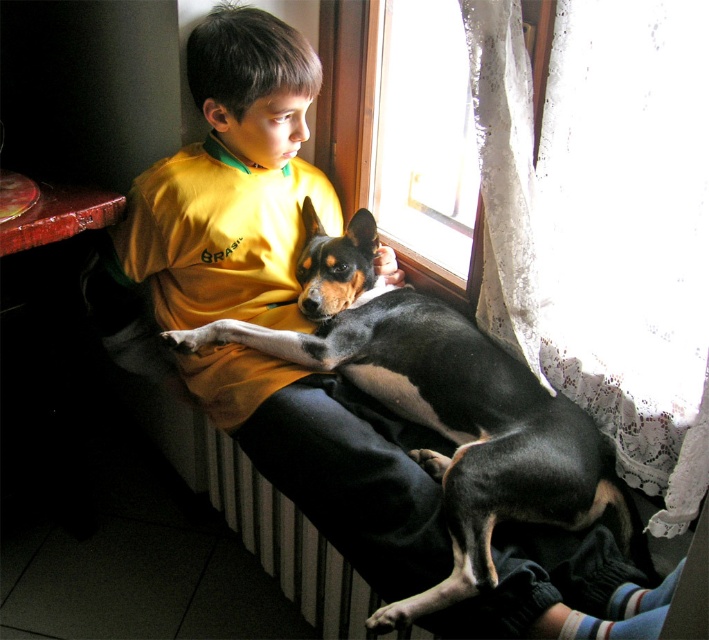
Between black smooth dog at center and transparent glass window at upper center, which one appears on the left side from the viewer's perspective?

black smooth dog at center is more to the left.

Can you confirm if black smooth dog at center is thinner than transparent glass window at upper center?

No, black smooth dog at center is not thinner than transparent glass window at upper center.

Is point (501, 424) positioned before point (462, 44)?

Yes.

Find the location of a particular element. black smooth dog at center is located at coordinates (442, 408).